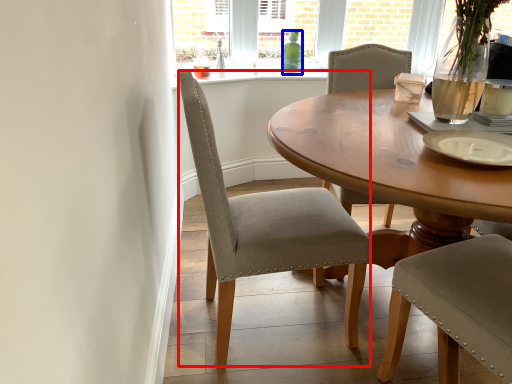
Question: Which of the following is the closest to the observer, chair (highlighted by a red box) or bottle (highlighted by a blue box)?

Choices:
 (A) chair
 (B) bottle

Answer: (A)